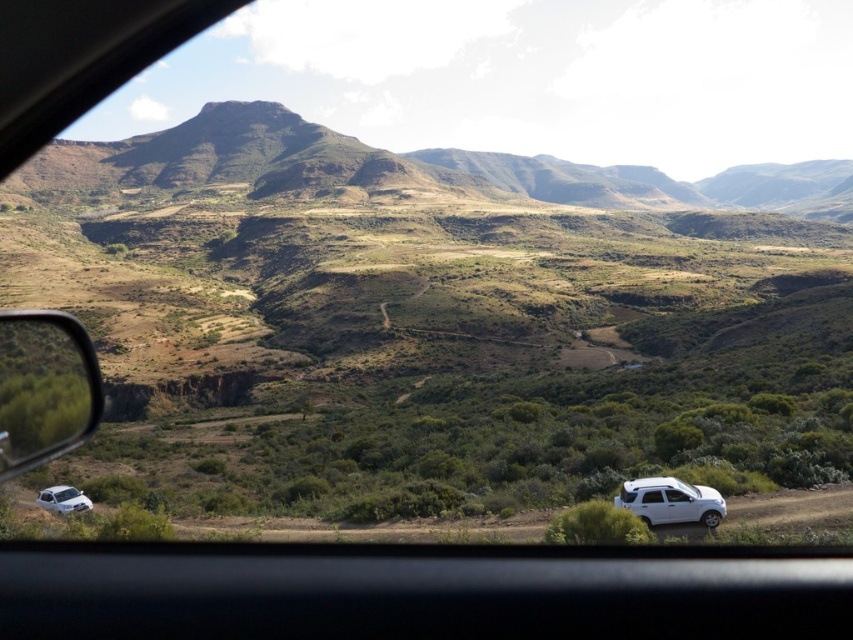
You are a passenger in the car and want to know where the point at coordinate [44,388] is located. Is it on the car window frame or the metallic side mirror at left?

The point at coordinate [44,388] is located on the metallic side mirror at left.

You are a passenger in the car and want to check the metallic side mirror at left. Where should you look on the screen if the screen coordinates are from 0 to 1 in both x and y directions?

The metallic side mirror at left is located at coordinates approximately 0.608 on the x axis and 0.053 on the y axis.